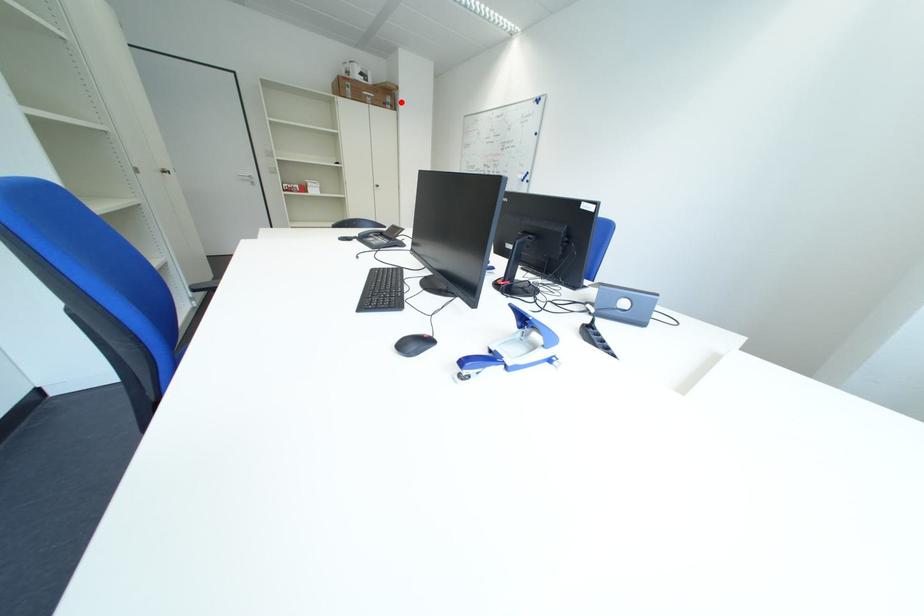
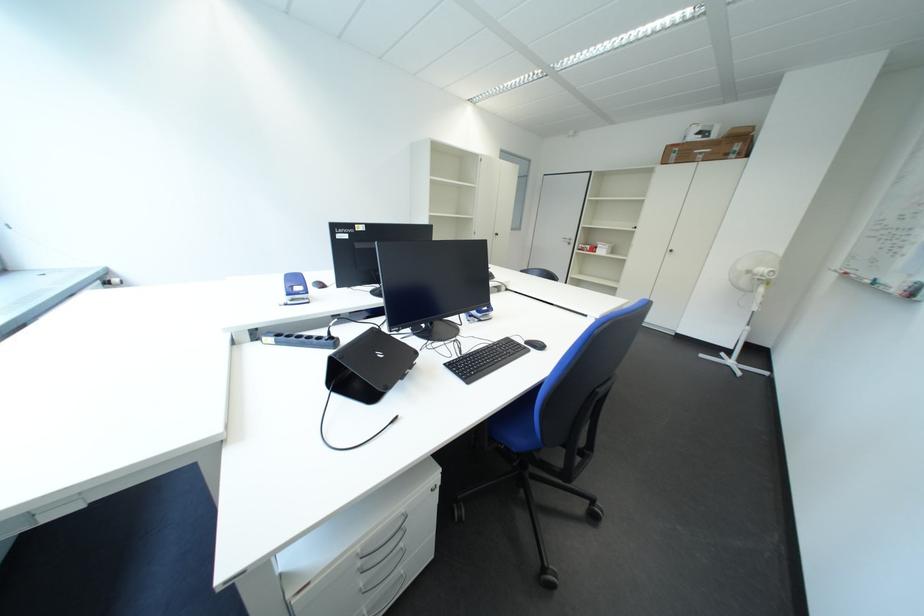
In the second image, find the point that corresponds to the highlighted location in the first image.

(748, 150)